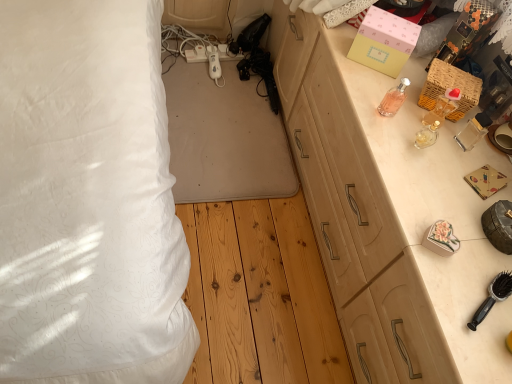
The image size is (512, 384). Find the location of `vacant area that lies to the right of clear glass perfume at upper right, marked as the 3th perfume in a left-to-right arrangement`. vacant area that lies to the right of clear glass perfume at upper right, marked as the 3th perfume in a left-to-right arrangement is located at coordinates (478, 139).